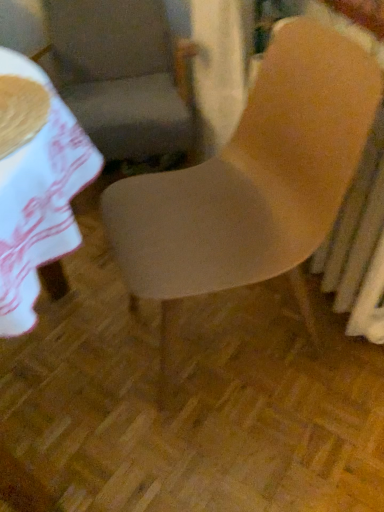
Measure the distance between matte gray chair at center, which is the second chair in front-to-back order, and camera.

matte gray chair at center, which is the second chair in front-to-back order, is 1.49 meters away from camera.

In order to click on matte gray chair at center, which is the 1th chair in back-to-front order in this screenshot , I will do `click(111, 69)`.

What do you see at coordinates (111, 69) in the screenshot? I see `matte gray chair at center, which is the 1th chair in back-to-front order` at bounding box center [111, 69].

Describe the element at coordinates (252, 183) in the screenshot. The height and width of the screenshot is (512, 384). I see `matte wood chair at center, which appears as the 1th chair when viewed from the front` at that location.

At what (x,y) coordinates should I click in order to perform the action: click on matte wood chair at center, the second chair positioned from the back. Please return your answer as a coordinate pair (x, y). This screenshot has height=512, width=384. Looking at the image, I should click on (252, 183).

The height and width of the screenshot is (512, 384). What are the coordinates of `matte gray chair at center, which is the second chair in front-to-back order` in the screenshot? It's located at (111, 69).

Between matte wood chair at center, the second chair positioned from the back, and matte gray chair at center, which is the second chair in front-to-back order, which one appears on the right side from the viewer's perspective?

Positioned to the right is matte wood chair at center, the second chair positioned from the back.

Between matte wood chair at center, which appears as the 1th chair when viewed from the front, and matte gray chair at center, which is the second chair in front-to-back order, which one is positioned behind?

matte gray chair at center, which is the second chair in front-to-back order, is more distant.

Which point is more forward, (242, 226) or (151, 29)?

Point (242, 226)

From the image's perspective, does matte wood chair at center, the second chair positioned from the back, appear higher than matte gray chair at center, which is the second chair in front-to-back order?

Incorrect, from the image's perspective, matte wood chair at center, the second chair positioned from the back, is lower than matte gray chair at center, which is the second chair in front-to-back order.

From a real-world perspective, is matte wood chair at center, which appears as the 1th chair when viewed from the front, positioned under matte gray chair at center, which is the second chair in front-to-back order, based on gravity?

No.

Which of these two, matte wood chair at center, the second chair positioned from the back, or matte gray chair at center, which is the second chair in front-to-back order, is thinner?

Thinner between the two is matte wood chair at center, the second chair positioned from the back.

Which of these two, matte wood chair at center, which appears as the 1th chair when viewed from the front, or matte gray chair at center, which is the second chair in front-to-back order, stands taller?

matte wood chair at center, which appears as the 1th chair when viewed from the front, is taller.

Considering the sizes of objects matte wood chair at center, the second chair positioned from the back, and matte gray chair at center, which is the second chair in front-to-back order, in the image provided, who is smaller, matte wood chair at center, the second chair positioned from the back, or matte gray chair at center, which is the second chair in front-to-back order,?

With smaller size is matte wood chair at center, the second chair positioned from the back.

Looking at this image, is matte wood chair at center, the second chair positioned from the back, not within matte gray chair at center, which is the 1th chair in back-to-front order?

Yes, matte wood chair at center, the second chair positioned from the back, is outside of matte gray chair at center, which is the 1th chair in back-to-front order.

Can you see matte wood chair at center, which appears as the 1th chair when viewed from the front, touching matte gray chair at center, which is the second chair in front-to-back order?

No, matte wood chair at center, which appears as the 1th chair when viewed from the front, is not in contact with matte gray chair at center, which is the second chair in front-to-back order.

Could you tell me if matte wood chair at center, which appears as the 1th chair when viewed from the front, is facing matte gray chair at center, which is the 1th chair in back-to-front order?

No, matte wood chair at center, which appears as the 1th chair when viewed from the front, does not turn towards matte gray chair at center, which is the 1th chair in back-to-front order.

Could you measure the distance between matte wood chair at center, which appears as the 1th chair when viewed from the front, and matte gray chair at center, which is the second chair in front-to-back order?

matte wood chair at center, which appears as the 1th chair when viewed from the front, is 29.38 inches from matte gray chair at center, which is the second chair in front-to-back order.

What are the coordinates of `chair above the matte gray chair at center, which is the second chair in front-to-back order (from a real-world perspective)` in the screenshot? It's located at (252, 183).

Which object is positioned more to the right, matte gray chair at center, which is the 1th chair in back-to-front order, or matte wood chair at center, the second chair positioned from the back?

matte wood chair at center, the second chair positioned from the back, is more to the right.

Relative to matte wood chair at center, the second chair positioned from the back, is matte gray chair at center, which is the 1th chair in back-to-front order, in front or behind?

In the image, matte gray chair at center, which is the 1th chair in back-to-front order, appears behind matte wood chair at center, the second chair positioned from the back.

Does point (110, 40) come farther from viewer compared to point (171, 198)?

Yes, point (110, 40) is behind point (171, 198).

From the image's perspective, does matte gray chair at center, which is the second chair in front-to-back order, appear lower than matte wood chair at center, which appears as the 1th chair when viewed from the front?

Incorrect, from the image's perspective, matte gray chair at center, which is the second chair in front-to-back order, is higher than matte wood chair at center, which appears as the 1th chair when viewed from the front.

Consider the image. From a real-world perspective, is matte gray chair at center, which is the 1th chair in back-to-front order, below matte wood chair at center, which appears as the 1th chair when viewed from the front?

Indeed, from a real-world perspective, matte gray chair at center, which is the 1th chair in back-to-front order, is positioned beneath matte wood chair at center, which appears as the 1th chair when viewed from the front.

Can you confirm if matte gray chair at center, which is the 1th chair in back-to-front order, is wider than matte wood chair at center, which appears as the 1th chair when viewed from the front?

Yes.

Looking at this image, considering the relative sizes of matte gray chair at center, which is the second chair in front-to-back order, and matte wood chair at center, the second chair positioned from the back, in the image provided, is matte gray chair at center, which is the second chair in front-to-back order, taller than matte wood chair at center, the second chair positioned from the back,?

Incorrect, the height of matte gray chair at center, which is the second chair in front-to-back order, is not larger of that of matte wood chair at center, the second chair positioned from the back.

In terms of size, does matte gray chair at center, which is the second chair in front-to-back order, appear bigger or smaller than matte wood chair at center, which appears as the 1th chair when viewed from the front?

matte gray chair at center, which is the second chair in front-to-back order, is bigger than matte wood chair at center, which appears as the 1th chair when viewed from the front.

Is matte wood chair at center, which appears as the 1th chair when viewed from the front, a part of matte gray chair at center, which is the second chair in front-to-back order?

No, matte wood chair at center, which appears as the 1th chair when viewed from the front, is not inside matte gray chair at center, which is the second chair in front-to-back order.

Consider the image. Is matte gray chair at center, which is the second chair in front-to-back order, not near matte wood chair at center, the second chair positioned from the back?

matte gray chair at center, which is the second chair in front-to-back order, is actually quite close to matte wood chair at center, the second chair positioned from the back.

Is matte gray chair at center, which is the second chair in front-to-back order, oriented away from matte wood chair at center, which appears as the 1th chair when viewed from the front?

matte gray chair at center, which is the second chair in front-to-back order, does not have its back to matte wood chair at center, which appears as the 1th chair when viewed from the front.

Image resolution: width=384 pixels, height=512 pixels. In order to click on chair in front of the matte gray chair at center, which is the 1th chair in back-to-front order in this screenshot , I will do `click(252, 183)`.

Image resolution: width=384 pixels, height=512 pixels. In order to click on chair on the right of the matte gray chair at center, which is the 1th chair in back-to-front order in this screenshot , I will do `click(252, 183)`.

Locate an element on the screen. The image size is (384, 512). chair behind the matte wood chair at center, which appears as the 1th chair when viewed from the front is located at coordinates (111, 69).